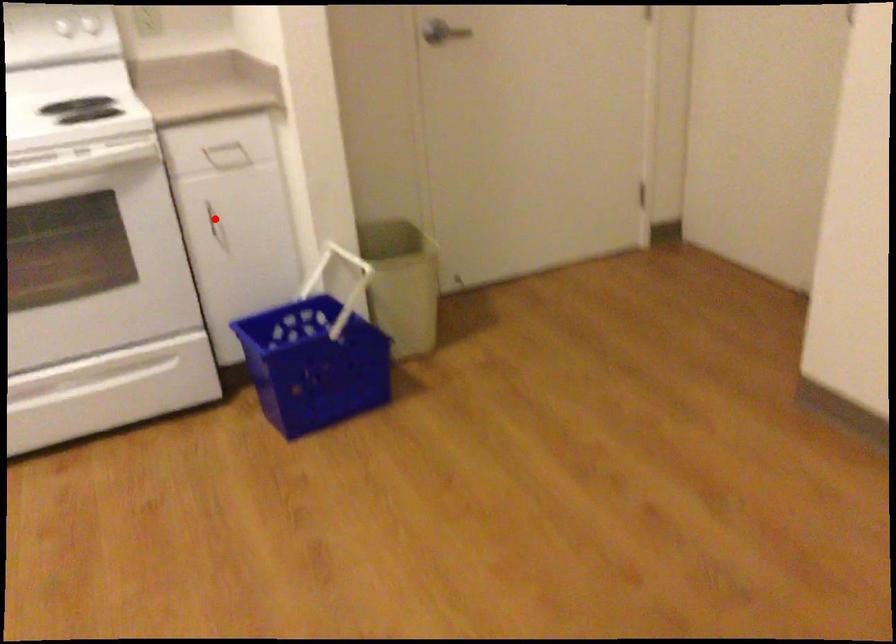
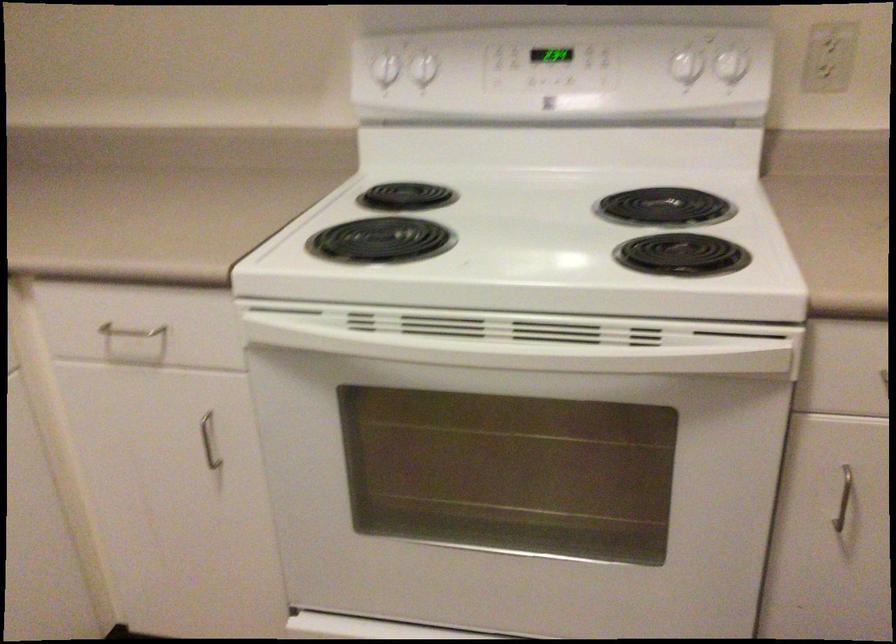
Question: I am providing you with two images of the same scene from different viewpoints. A red point is marked on the first image. At the location where the point appears in image 1, is it still visible in image 2?

Choices:
 (A) Yes
 (B) No

Answer: (A)